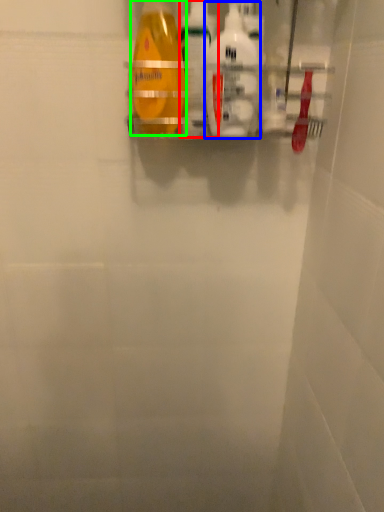
Question: Considering the real-world distances, which object is farthest from cleaning product (highlighted by a red box)? cleaning product (highlighted by a blue box) or bottle (highlighted by a green box)?

Choices:
 (A) cleaning product
 (B) bottle

Answer: (A)